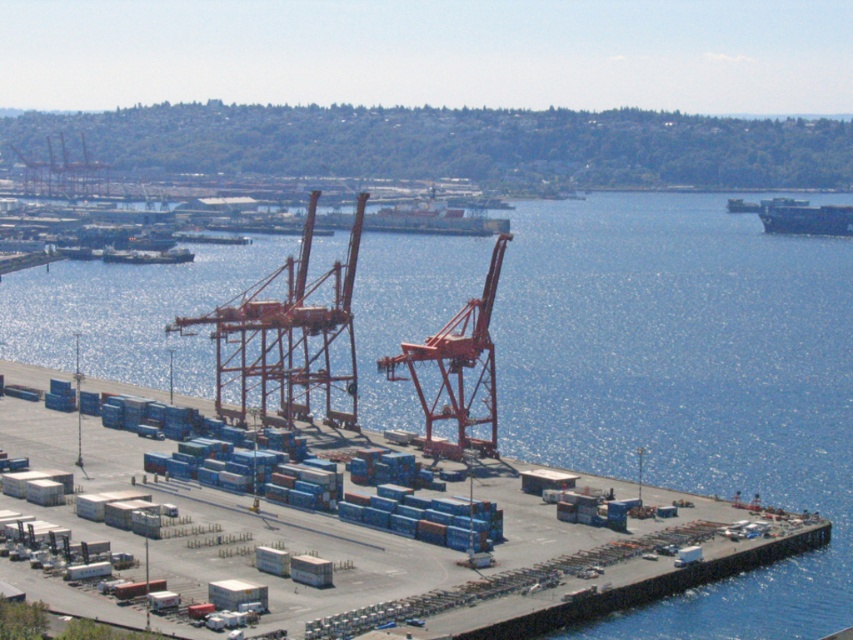
Question: Does metallic orange crane at center appear on the left side of orange metallic crane at upper left?

Choices:
 (A) no
 (B) yes

Answer: (A)

Question: Among these objects, which one is nearest to the camera?

Choices:
 (A) dark gray matte container ship at right
 (B) orange metallic crane at center
 (C) blue water at center
 (D) orange metallic crane at upper left

Answer: (C)

Question: Which object is closer to the camera taking this photo?

Choices:
 (A) blue water at center
 (B) orange metallic crane at center

Answer: (A)

Question: Which point is closer to the camera taking this photo?

Choices:
 (A) pos(305,248)
 (B) pos(793,220)
 (C) pos(44,173)

Answer: (A)

Question: Can you confirm if metallic orange crane at center is positioned to the right of orange metallic crane at upper left?

Choices:
 (A) no
 (B) yes

Answer: (B)

Question: From the image, what is the correct spatial relationship of metallic orange crane at center in relation to orange metallic crane at upper left?

Choices:
 (A) below
 (B) above

Answer: (A)